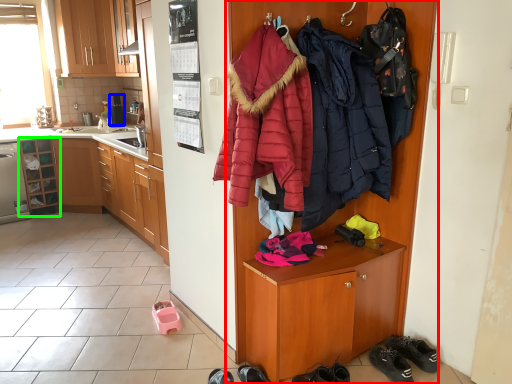
Question: Considering the real-world distances, which object is closest to cupboard (highlighted by a red box)? appliance (highlighted by a blue box) or cabinetry (highlighted by a green box).

Choices:
 (A) appliance
 (B) cabinetry

Answer: (B)